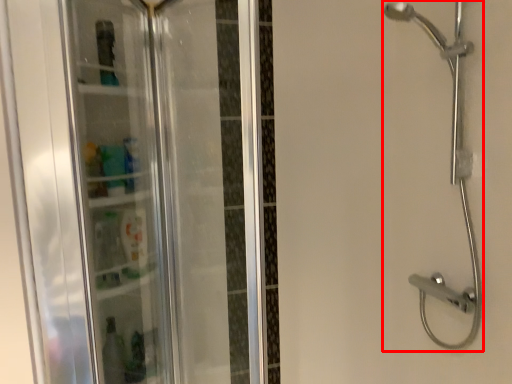
Question: Observing the image, what is the correct spatial positioning of shower (annotated by the red box) in reference to screen door?

Choices:
 (A) left
 (B) right

Answer: (B)